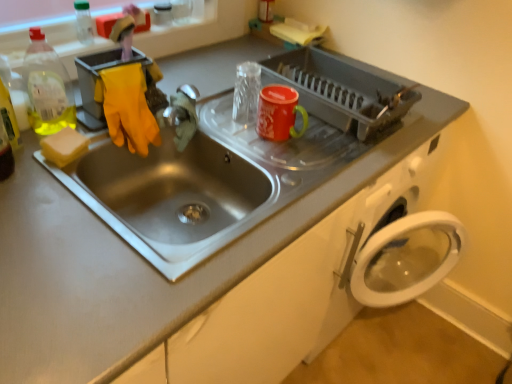
Locate an element on the screen. metallic silver faucet at sink center is located at coordinates (182, 114).

What do you see at coordinates (340, 90) in the screenshot? The width and height of the screenshot is (512, 384). I see `matte plastic dish rack at upper center` at bounding box center [340, 90].

At what (x,y) coordinates should I click in order to perform the action: click on matte plastic dish rack at upper center. Please return your answer as a coordinate pair (x, y). Looking at the image, I should click on (340, 90).

This screenshot has height=384, width=512. I want to click on yellow sponge at left, so click(64, 146).

In order to face translucent plastic bottle at upper left, which ranks as the 1th bottle in bottom-to-top order, should I rotate leftwards or rightwards?

Rotate left and turn 26.077 degrees.

You are a GUI agent. You are given a task and a screenshot of the screen. Output one action in this format:
    pyautogui.click(x=<x>, y=<y>)
    Task: Click on the clear plastic bottle at upper left, acting as the first bottle starting from the top
    
    Given the screenshot: What is the action you would take?
    pyautogui.click(x=83, y=22)

The height and width of the screenshot is (384, 512). I want to click on metallic silver faucet at sink center, so click(182, 114).

Consider the image. Which point is more forward, (86, 40) or (170, 119)?

Point (170, 119)

Could you tell me if clear plastic bottle at upper left, which ranks as the 1th bottle in back-to-front order, is facing metallic silver faucet at sink center?

Yes.

Between clear plastic bottle at upper left, acting as the first bottle starting from the top, and metallic silver faucet at sink center, which one has larger width?

metallic silver faucet at sink center is wider.

In the scene shown: Is clear plastic bottle at upper left, which ranks as the 1th bottle in back-to-front order, closer to the viewer compared to metallic silver faucet at sink center?

No, clear plastic bottle at upper left, which ranks as the 1th bottle in back-to-front order, is further to the viewer.

Between clear plastic bottle at upper left, acting as the first bottle starting from the top, and translucent plastic bottle at upper left, which ranks as the 2th bottle in back-to-front order, which one is positioned behind?

clear plastic bottle at upper left, acting as the first bottle starting from the top, is further from the camera.

Is point (79, 35) closer to viewer compared to point (42, 56)?

No, it is behind (42, 56).

From the image's perspective, does clear plastic bottle at upper left, which is the second bottle in bottom-to-top order, appear lower than translucent plastic bottle at upper left, which ranks as the 2th bottle in back-to-front order?

No, from the image's perspective, clear plastic bottle at upper left, which is the second bottle in bottom-to-top order, is not below translucent plastic bottle at upper left, which ranks as the 2th bottle in back-to-front order.

Is translucent plastic bottle at upper left, which ranks as the second bottle in top-to-bottom order, next to metallic silver faucet at sink center?

No, translucent plastic bottle at upper left, which ranks as the second bottle in top-to-bottom order, is not with metallic silver faucet at sink center.

Does translucent plastic bottle at upper left, which ranks as the 2th bottle in back-to-front order, have a lesser width compared to metallic silver faucet at sink center?

No, translucent plastic bottle at upper left, which ranks as the 2th bottle in back-to-front order, is not thinner than metallic silver faucet at sink center.

Considering the sizes of objects translucent plastic bottle at upper left, which is the 1th bottle in front-to-back order, and metallic silver faucet at sink center in the image provided, who is smaller, translucent plastic bottle at upper left, which is the 1th bottle in front-to-back order, or metallic silver faucet at sink center?

metallic silver faucet at sink center.

Is translucent plastic bottle at upper left, which is the 1th bottle in front-to-back order, facing away from metallic silver faucet at sink center?

translucent plastic bottle at upper left, which is the 1th bottle in front-to-back order, is not turned away from metallic silver faucet at sink center.

Is yellow sponge at left positioned behind translucent plastic bottle at upper left, which ranks as the second bottle in top-to-bottom order?

Yes.

Would you say translucent plastic bottle at upper left, which is the 1th bottle in front-to-back order, is part of yellow sponge at left's contents?

Definitely not — translucent plastic bottle at upper left, which is the 1th bottle in front-to-back order, is not inside yellow sponge at left.

Is yellow sponge at left to the right of translucent plastic bottle at upper left, which ranks as the 1th bottle in bottom-to-top order, from the viewer's perspective?

Yes, yellow sponge at left is to the right of translucent plastic bottle at upper left, which ranks as the 1th bottle in bottom-to-top order.

Considering the sizes of yellow sponge at left and translucent plastic bottle at upper left, which ranks as the 1th bottle in bottom-to-top order, in the image, is yellow sponge at left wider or thinner than translucent plastic bottle at upper left, which ranks as the 1th bottle in bottom-to-top order,?

Considering their sizes, yellow sponge at left looks slimmer than translucent plastic bottle at upper left, which ranks as the 1th bottle in bottom-to-top order.

Which object is closer to the camera taking this photo, matte plastic dish rack at upper center or translucent plastic bottle at upper left, which ranks as the 2th bottle in back-to-front order?

Positioned in front is translucent plastic bottle at upper left, which ranks as the 2th bottle in back-to-front order.

Which of these two, matte plastic dish rack at upper center or translucent plastic bottle at upper left, which ranks as the 2th bottle in back-to-front order, is smaller?

translucent plastic bottle at upper left, which ranks as the 2th bottle in back-to-front order, is smaller.

In terms of height, does matte plastic dish rack at upper center look taller or shorter compared to translucent plastic bottle at upper left, which ranks as the second bottle in top-to-bottom order?

In the image, matte plastic dish rack at upper center appears to be shorter than translucent plastic bottle at upper left, which ranks as the second bottle in top-to-bottom order.

Is translucent plastic bottle at upper left, which is the 1th bottle in front-to-back order, at the back of matte plastic dish rack at upper center?

No.

Does point (61, 153) come in front of point (189, 124)?

Yes.

Would you say metallic silver faucet at sink center is part of yellow sponge at left's contents?

No, yellow sponge at left does not contain metallic silver faucet at sink center.

From the image's perspective, which one is positioned lower, yellow sponge at left or metallic silver faucet at sink center?

From the image's view, yellow sponge at left is below.

From the picture: Is yellow sponge at left touching metallic silver faucet at sink center?

No, yellow sponge at left is not next to metallic silver faucet at sink center.

Measure the distance from translucent plastic bottle at upper left, which is the 1th bottle in front-to-back order, to clear plastic bottle at upper left, which is the second bottle in bottom-to-top order.

A distance of 10.44 inches exists between translucent plastic bottle at upper left, which is the 1th bottle in front-to-back order, and clear plastic bottle at upper left, which is the second bottle in bottom-to-top order.

From the image's perspective, is translucent plastic bottle at upper left, which ranks as the 1th bottle in bottom-to-top order, on top of clear plastic bottle at upper left, the 2th bottle when ordered from front to back?

No, from the image's perspective, translucent plastic bottle at upper left, which ranks as the 1th bottle in bottom-to-top order, is not over clear plastic bottle at upper left, the 2th bottle when ordered from front to back.

Does translucent plastic bottle at upper left, which ranks as the second bottle in top-to-bottom order, lie in front of clear plastic bottle at upper left, which ranks as the 1th bottle in back-to-front order?

Yes, translucent plastic bottle at upper left, which ranks as the second bottle in top-to-bottom order, is closer to the camera.

Identify the location of faucet below the clear plastic bottle at upper left, which ranks as the 1th bottle in back-to-front order (from the image's perspective). (182, 114).

Find the location of `bottle located underneath the clear plastic bottle at upper left, the 2th bottle when ordered from front to back (from a real-world perspective)`. bottle located underneath the clear plastic bottle at upper left, the 2th bottle when ordered from front to back (from a real-world perspective) is located at coordinates (47, 87).

Looking at the image, which one is located further to translucent plastic bottle at upper left, which ranks as the second bottle in top-to-bottom order, metallic silver faucet at sink center or matte plastic dish rack at upper center?

matte plastic dish rack at upper center is further to translucent plastic bottle at upper left, which ranks as the second bottle in top-to-bottom order.

Looking at the image, which one is located further to translucent plastic bottle at upper left, which is the 1th bottle in front-to-back order, yellow sponge at left or matte plastic dish rack at upper center?

matte plastic dish rack at upper center is positioned further to the anchor translucent plastic bottle at upper left, which is the 1th bottle in front-to-back order.

When comparing their distances from clear plastic bottle at upper left, acting as the first bottle starting from the top, does matte plastic dish rack at upper center or yellow sponge at left seem closer?

yellow sponge at left.

Which object lies nearer to the anchor point clear plastic bottle at upper left, the 2th bottle when ordered from front to back, yellow sponge at left or matte plastic dish rack at upper center?

The object closer to clear plastic bottle at upper left, the 2th bottle when ordered from front to back, is yellow sponge at left.

Estimate the real-world distances between objects in this image. Which object is closer to translucent plastic bottle at upper left, which ranks as the 1th bottle in bottom-to-top order, yellow sponge at left or clear plastic bottle at upper left, which is the second bottle in bottom-to-top order?

yellow sponge at left lies closer to translucent plastic bottle at upper left, which ranks as the 1th bottle in bottom-to-top order, than the other object.

Which object lies further to the anchor point yellow sponge at left, translucent plastic bottle at upper left, which ranks as the 1th bottle in bottom-to-top order, or matte plastic dish rack at upper center?

Among the two, matte plastic dish rack at upper center is located further to yellow sponge at left.

Which object lies nearer to the anchor point matte plastic dish rack at upper center, yellow sponge at left or translucent plastic bottle at upper left, which ranks as the 2th bottle in back-to-front order?

translucent plastic bottle at upper left, which ranks as the 2th bottle in back-to-front order, is positioned closer to the anchor matte plastic dish rack at upper center.

From the image, which object appears to be nearer to matte plastic dish rack at upper center, yellow sponge at left or metallic silver faucet at sink center?

The object closer to matte plastic dish rack at upper center is metallic silver faucet at sink center.

Locate an element on the screen. bottle located between clear plastic bottle at upper left, acting as the first bottle starting from the top, and matte plastic dish rack at upper center in the left-right direction is located at coordinates (47, 87).

The image size is (512, 384). What are the coordinates of `soap located between translucent plastic bottle at upper left, which ranks as the 2th bottle in back-to-front order, and metallic silver faucet at sink center in the left-right direction` in the screenshot? It's located at (64, 146).

I want to click on faucet between translucent plastic bottle at upper left, which ranks as the 2th bottle in back-to-front order, and clear plastic bottle at upper left, which is the second bottle in bottom-to-top order, from front to back, so click(x=182, y=114).

At what (x,y) coordinates should I click in order to perform the action: click on faucet between clear plastic bottle at upper left, which ranks as the 1th bottle in back-to-front order, and yellow sponge at left in the up-down direction. Please return your answer as a coordinate pair (x, y). Looking at the image, I should click on click(x=182, y=114).